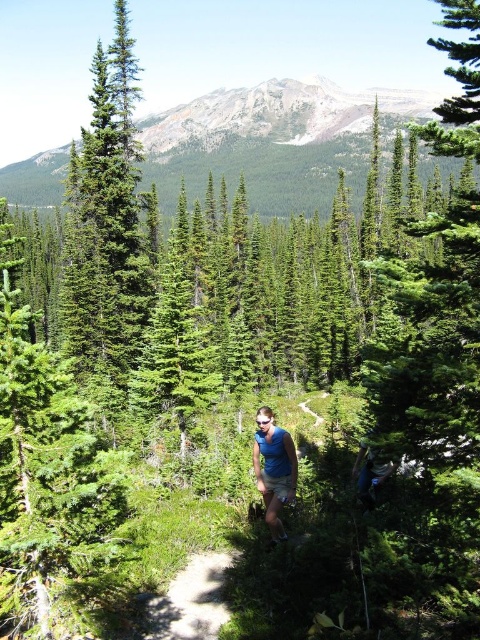
Find the location of a particular element. The width and height of the screenshot is (480, 640). green fir tree at left is located at coordinates (106, 234).

What do you see at coordinates (106, 234) in the screenshot? The image size is (480, 640). I see `green fir tree at left` at bounding box center [106, 234].

What do you see at coordinates (106, 234) in the screenshot? I see `green fir tree at left` at bounding box center [106, 234].

What are the coordinates of `green fir tree at left` in the screenshot? It's located at (106, 234).

Between point (105, 227) and point (154, 611), which one is positioned behind?

The point (105, 227) is more distant.

Describe the element at coordinates (106, 234) in the screenshot. The image size is (480, 640). I see `green fir tree at left` at that location.

Is point (93, 77) behind point (165, 616)?

Yes, it is behind point (165, 616).

Find the location of a particular element. This screenshot has height=640, width=480. green fir tree at left is located at coordinates point(106,234).

Can you confirm if green textured mountain at upper center is wider than dirt path at center?

Indeed, green textured mountain at upper center has a greater width compared to dirt path at center.

Is point (290, 144) closer to viewer compared to point (201, 604)?

No, (290, 144) is behind (201, 604).

In order to click on green textured mountain at upper center in this screenshot , I will do `click(263, 145)`.